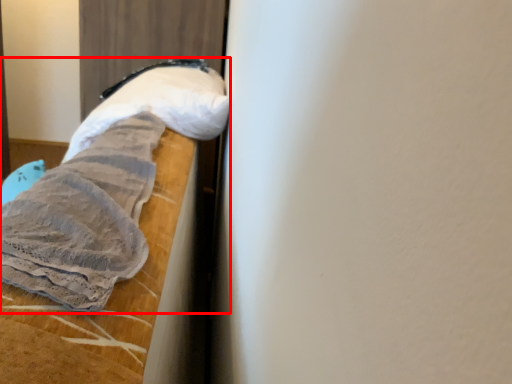
Question: From the image's perspective, where is sheet (annotated by the red box) located relative to footwear?

Choices:
 (A) above
 (B) below

Answer: (B)